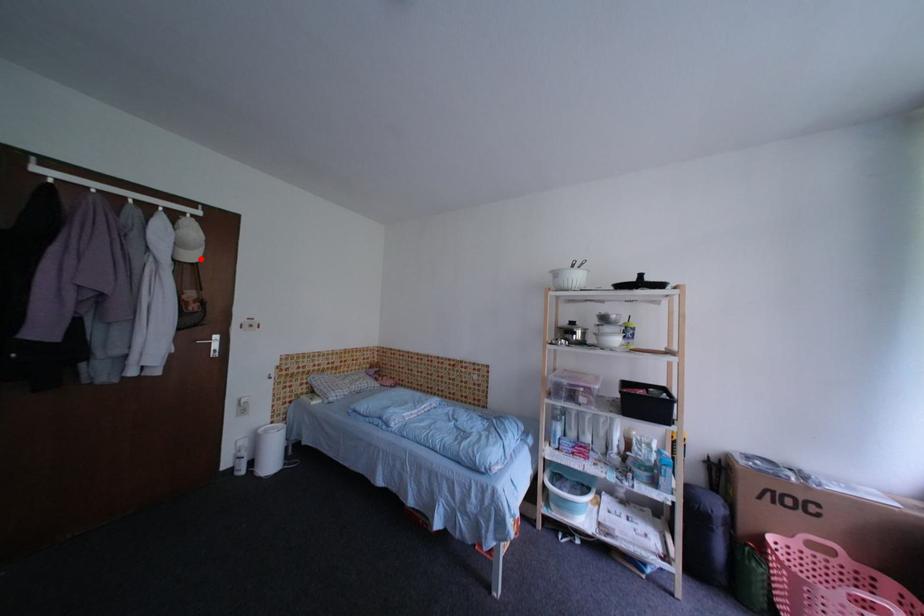
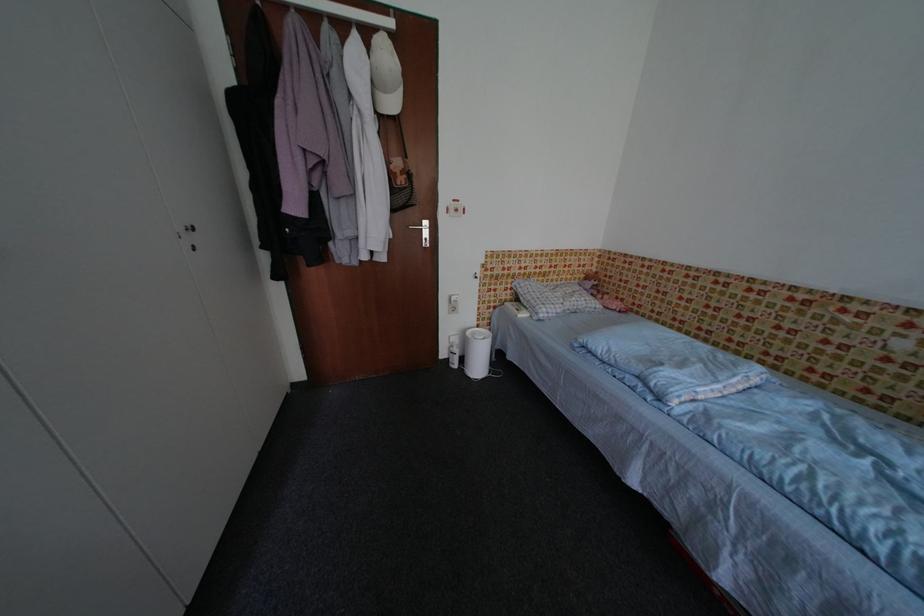
The point at the highlighted location is marked in the first image. Where is the corresponding point in the second image?

(400, 107)